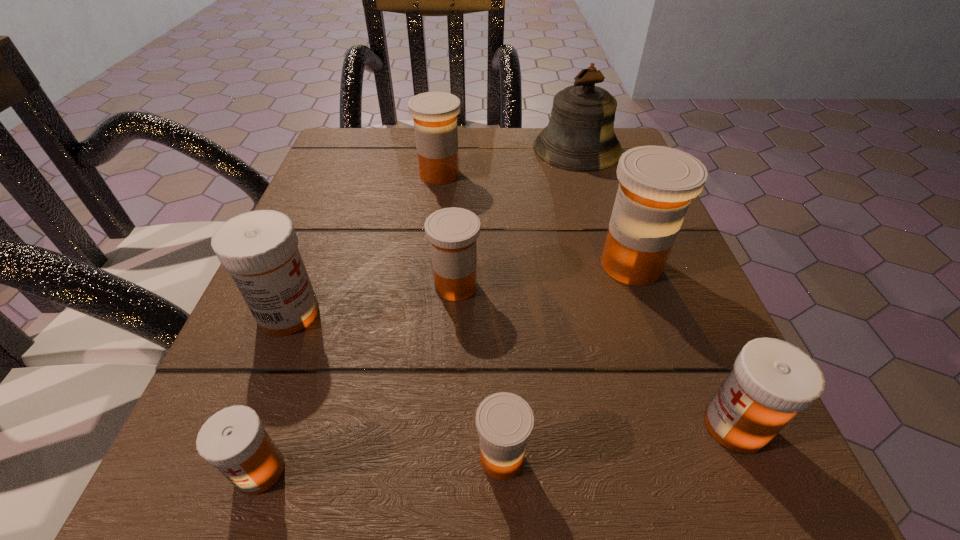
Identify the location of vacant space situated 0.170m on the label of the nearest orange medicine. (x=324, y=458).

Where is `vacant space located on the right of the smallest white medicine`? Image resolution: width=960 pixels, height=540 pixels. vacant space located on the right of the smallest white medicine is located at coordinates (461, 471).

At what (x,y) coordinates should I click in order to perform the action: click on bell situated at the far edge. Please return your answer as a coordinate pair (x, y). Looking at the image, I should click on [x=580, y=136].

Identify the location of medicine that is positioned at the far edge. The height and width of the screenshot is (540, 960). (x=435, y=114).

Locate an element on the screen. bell present at the right edge is located at coordinates (580, 136).

What are the coordinates of `object at the near left corner` in the screenshot? It's located at (234, 440).

Locate an element on the screen. The width and height of the screenshot is (960, 540). object at the far right corner is located at coordinates pyautogui.click(x=580, y=136).

You are a GUI agent. You are given a task and a screenshot of the screen. Output one action in this format:
    pyautogui.click(x=<x>, y=<y>)
    Task: Click on the object present at the near right corner
    
    Given the screenshot: What is the action you would take?
    pyautogui.click(x=772, y=380)

In the image, there is a desktop. Where is `vacant space at the far edge`? The image size is (960, 540). vacant space at the far edge is located at coordinates point(525,171).

What are the coordinates of `free space at the near edge of the desktop` in the screenshot? It's located at (575, 502).